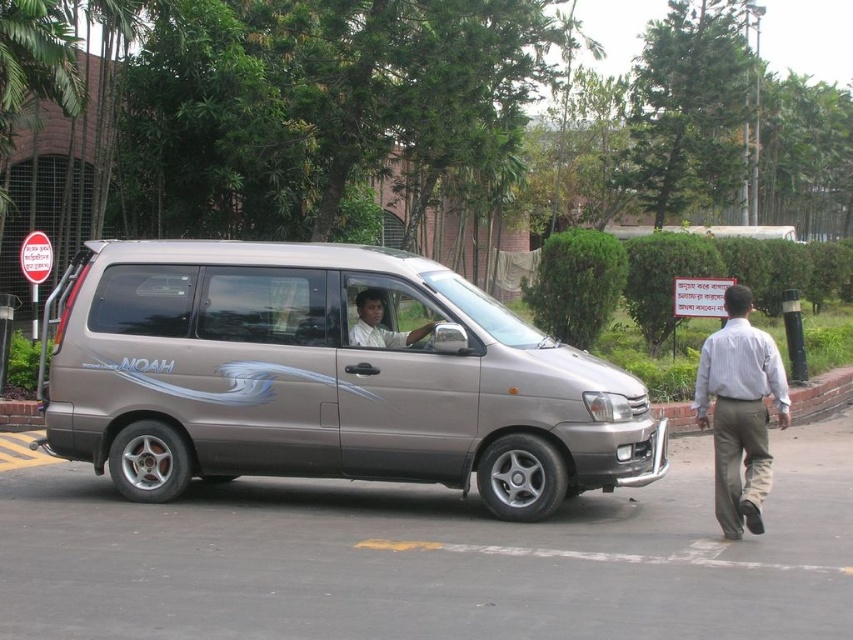
Question: Which object appears farthest from the camera in this image?

Choices:
 (A) light brown shirt at center
 (B) satin metallic van at center

Answer: (A)

Question: Which point is farther to the camera?

Choices:
 (A) (363, 300)
 (B) (769, 452)
 (C) (82, 413)

Answer: (C)

Question: Considering the real-world distances, which object is farthest from the light brown shirt at center?

Choices:
 (A) satin metallic van at center
 (B) light gray shirt at center

Answer: (B)

Question: Can you confirm if light gray shirt at center is positioned above light brown shirt at center?

Choices:
 (A) yes
 (B) no

Answer: (B)

Question: Does light gray shirt at center appear under light brown shirt at center?

Choices:
 (A) yes
 (B) no

Answer: (A)

Question: In this image, where is satin metallic van at center located relative to light gray shirt at center?

Choices:
 (A) above
 (B) below

Answer: (A)